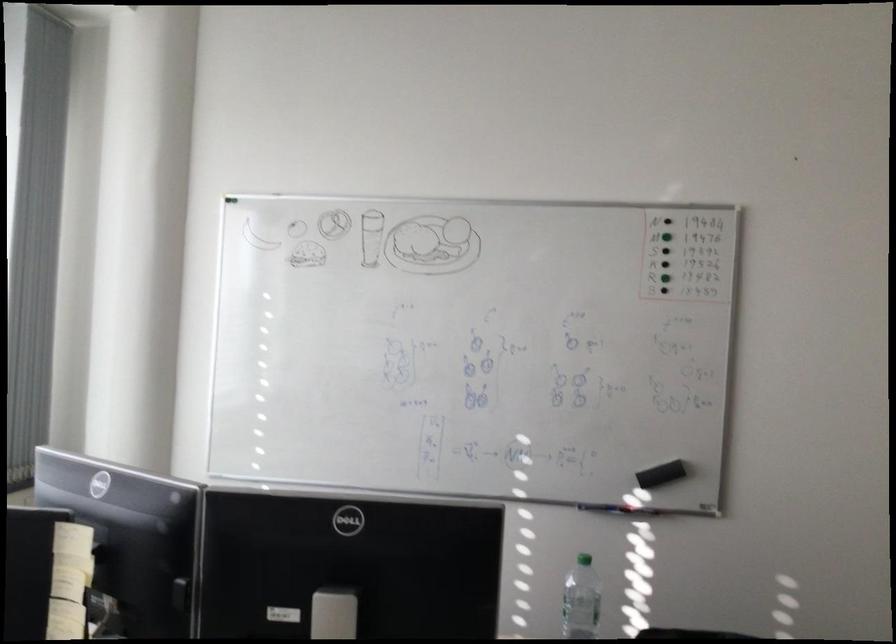
Locate an element on the screen. The width and height of the screenshot is (896, 644). green bottle cap is located at coordinates (583, 560).